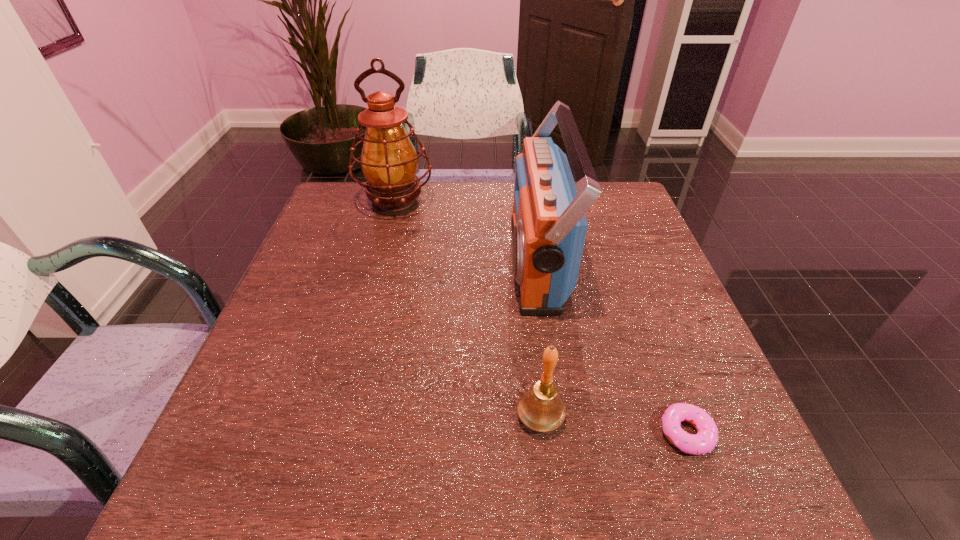
Find the location of `free spot between the rightmost object and the third tallest object`. free spot between the rightmost object and the third tallest object is located at coordinates (613, 425).

Locate an element on the screen. This screenshot has height=540, width=960. free point between the rightmost object and the tallest object is located at coordinates (541, 319).

Find the location of `vacant area that lies between the doughnut and the second tallest object`. vacant area that lies between the doughnut and the second tallest object is located at coordinates (612, 348).

Identify the location of free spot between the third shortest object and the second shortest object. (539, 340).

Where is `vacant space that's between the third tallest object and the third shortest object`? vacant space that's between the third tallest object and the third shortest object is located at coordinates (539, 340).

I want to click on free space between the second shortest object and the leftmost object, so click(468, 310).

Identify which object is located as the third nearest to the leftmost object. Please provide its 2D coordinates. Your answer should be formatted as a tuple, i.e. [(x, y)], where the tuple contains the x and y coordinates of a point satisfying the conditions above.

[(706, 439)]

In order to click on object that is the third closest to the radio receiver in this screenshot , I will do coord(706,439).

In order to click on vacant space that satisfies the following two spatial constraints: 1. on the front side of the shortest object; 2. on the right side of the tallest object in this screenshot , I will do `click(336, 433)`.

This screenshot has width=960, height=540. In order to click on free spot that satisfies the following two spatial constraints: 1. on the front-facing side of the third shortest object; 2. on the right side of the doughnut in this screenshot , I will do `click(563, 433)`.